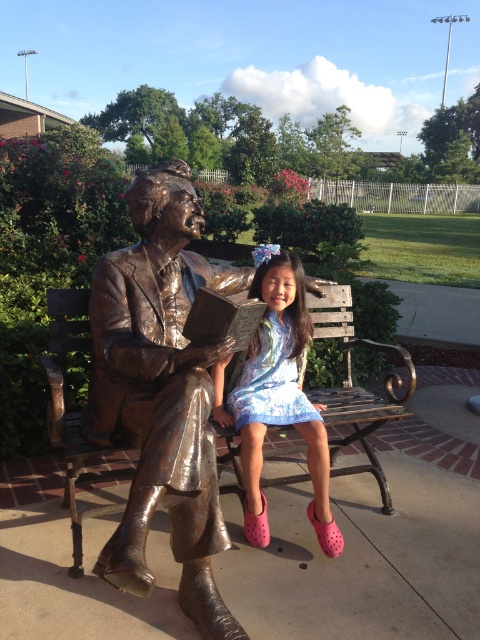
Based on the photo, which is more to the right, bronze statue at center or matte blue dress at center?

matte blue dress at center is more to the right.

Can you confirm if bronze statue at center is positioned to the right of matte blue dress at center?

No, bronze statue at center is not to the right of matte blue dress at center.

Is point (104, 296) positioned behind point (298, 273)?

No, it is in front of (298, 273).

Image resolution: width=480 pixels, height=640 pixels. I want to click on bronze statue at center, so click(160, 392).

Describe the element at coordinates (357, 387) in the screenshot. The image size is (480, 640). I see `wooden bench at center` at that location.

Is point (368, 342) behind point (314, 406)?

Yes, point (368, 342) is farther from viewer.

The image size is (480, 640). Identify the location of wooden bench at center. coord(357,387).

Does bronze statue at center have a lesser height compared to wooden bench at center?

No, bronze statue at center is not shorter than wooden bench at center.

Can you confirm if bronze statue at center is positioned below wooden bench at center?

No, bronze statue at center is not below wooden bench at center.

Is point (193, 221) behind point (72, 490)?

That is True.

You are a GUI agent. You are given a task and a screenshot of the screen. Output one action in this format:
    pyautogui.click(x=<x>, y=<y>)
    Task: Click on the bronze statue at center
    This screenshot has height=640, width=480.
    Given the screenshot: What is the action you would take?
    pyautogui.click(x=160, y=392)